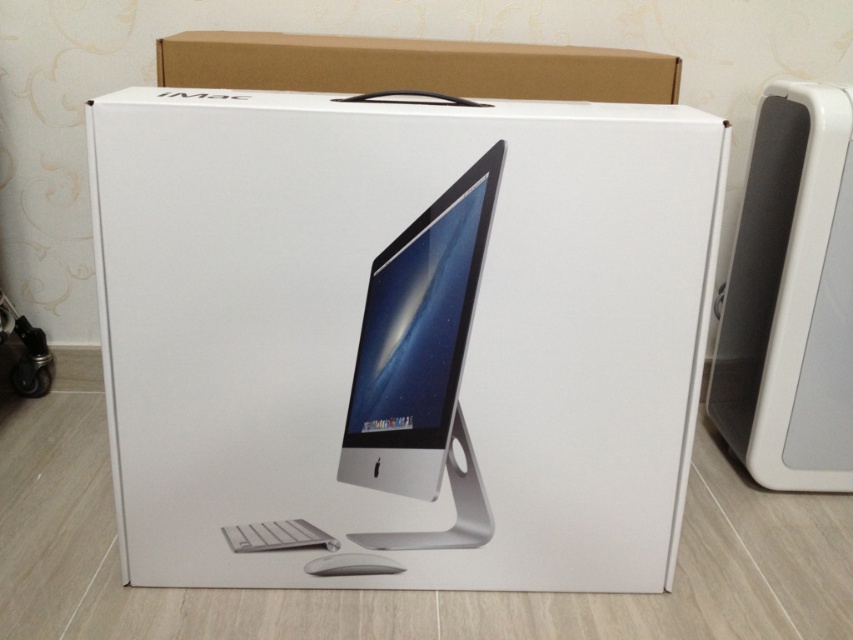
Question: Considering the real-world distances, which object is farthest from the white plastic speaker at right?

Choices:
 (A) white matte cardboard box at center
 (B) white matte mouse at lower center
 (C) brown cardboard at upper center

Answer: (B)

Question: Which point is closer to the camera?

Choices:
 (A) white matte cardboard box at center
 (B) brown cardboard at upper center
 (C) white glossy computer monitor at center
 (D) white plastic speaker at right

Answer: (A)

Question: Which object appears closest to the camera in this image?

Choices:
 (A) white matte mouse at lower center
 (B) white plastic speaker at right
 (C) white matte cardboard box at center
 (D) brown cardboard at upper center

Answer: (C)

Question: Is white plastic speaker at right thinner than white glossy computer monitor at center?

Choices:
 (A) yes
 (B) no

Answer: (A)

Question: Can you confirm if white plastic speaker at right is positioned to the left of white glossy computer monitor at center?

Choices:
 (A) yes
 (B) no

Answer: (B)

Question: Does white matte cardboard box at center come behind white plastic speaker at right?

Choices:
 (A) no
 (B) yes

Answer: (A)